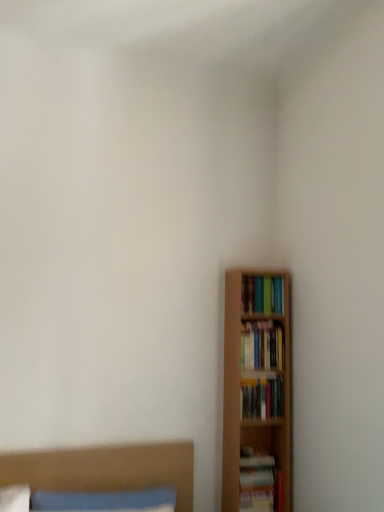
Question: From the image's perspective, is hardcover books at right, which ranks as the 3th book in top-to-bottom order, under hardcover book at lower right, the 4th book from the top?

Choices:
 (A) yes
 (B) no

Answer: (B)

Question: Is hardcover books at right, which ranks as the 3th book in top-to-bottom order, thinner than hardcover book at lower right, arranged as the first book when ordered from the bottom?

Choices:
 (A) yes
 (B) no

Answer: (A)

Question: Is hardcover book at lower right, the 4th book from the top, a part of hardcover books at right, which ranks as the 3th book in top-to-bottom order?

Choices:
 (A) no
 (B) yes

Answer: (A)

Question: Are hardcover books at right, acting as the second book starting from the bottom, and hardcover book at lower right, the 4th book from the top, far apart?

Choices:
 (A) yes
 (B) no

Answer: (B)

Question: Is the position of hardcover books at right, which ranks as the 3th book in top-to-bottom order, less distant than that of hardcover book at lower right, the 4th book from the top?

Choices:
 (A) no
 (B) yes

Answer: (A)

Question: Is point (273, 415) closer or farther from the camera than point (278, 367)?

Choices:
 (A) closer
 (B) farther

Answer: (A)

Question: Considering the positions of hardcover books at right, which ranks as the 3th book in top-to-bottom order, and hardcover books at right, which is the 2th book in top-to-bottom order, in the image, is hardcover books at right, which ranks as the 3th book in top-to-bottom order, bigger or smaller than hardcover books at right, which is the 2th book in top-to-bottom order,?

Choices:
 (A) big
 (B) small

Answer: (B)

Question: Considering their positions, is hardcover books at right, which ranks as the 3th book in top-to-bottom order, located in front of or behind hardcover books at right, which is the 2th book in top-to-bottom order?

Choices:
 (A) front
 (B) behind

Answer: (A)

Question: Considering the positions of hardcover books at right, which ranks as the 3th book in top-to-bottom order, and hardcover books at right, placed as the third book when sorted from bottom to top, in the image, is hardcover books at right, which ranks as the 3th book in top-to-bottom order, taller or shorter than hardcover books at right, placed as the third book when sorted from bottom to top,?

Choices:
 (A) short
 (B) tall

Answer: (A)

Question: Considering their positions, is hardcover book at lower right, the 4th book from the top, located in front of or behind wooden bed at lower left?

Choices:
 (A) behind
 (B) front

Answer: (A)

Question: Is hardcover book at lower right, arranged as the first book when ordered from the bottom, inside or outside of wooden bed at lower left?

Choices:
 (A) inside
 (B) outside

Answer: (B)

Question: From their relative heights in the image, would you say hardcover book at lower right, the 4th book from the top, is taller or shorter than wooden bed at lower left?

Choices:
 (A) short
 (B) tall

Answer: (A)

Question: Looking at their shapes, would you say hardcover book at lower right, the 4th book from the top, is wider or thinner than wooden bed at lower left?

Choices:
 (A) wide
 (B) thin

Answer: (B)

Question: In the image, is wooden bed at lower left positioned in front of or behind hardcover book at lower right, the 4th book from the top?

Choices:
 (A) front
 (B) behind

Answer: (A)

Question: In terms of width, does wooden bed at lower left look wider or thinner when compared to hardcover book at lower right, the 4th book from the top?

Choices:
 (A) thin
 (B) wide

Answer: (B)